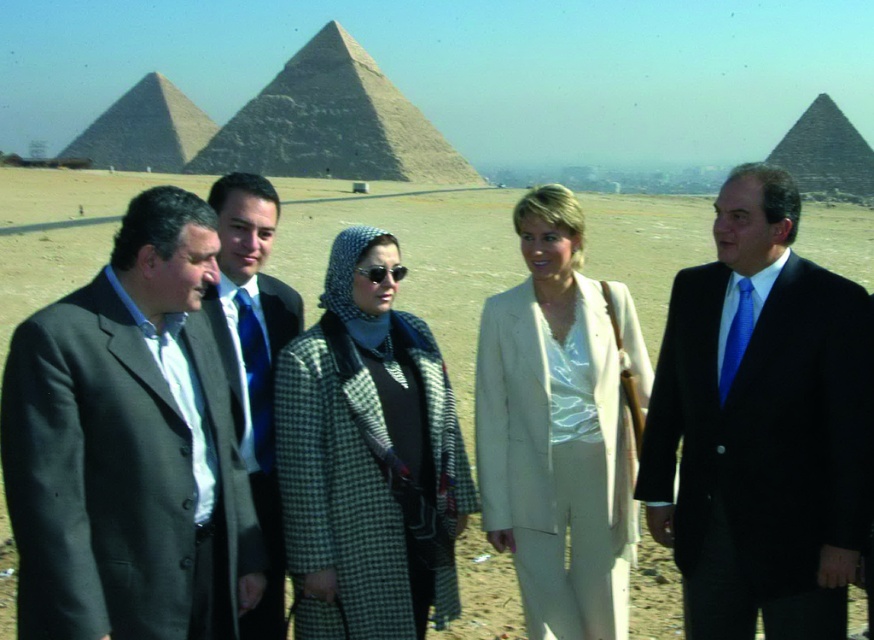
You are a photographer positioned to the left of the group. You want to capture a photo where the blue silk tie at center and the smooth stone pyramid at upper left are both visible. Which object should you position closer to the left side of the frame to ensure both are included?

You should position the smooth stone pyramid at upper left closer to the left side of the frame because the blue silk tie at center is to the right of it. By placing the pyramid on the left, you can ensure the tie, being to the right of the pyramid, stays within the frame.

You are a photographer trying to capture a clear shot of the beige fabric suit at center without the desert at center blocking it. Is this possible given their positions?

The desert at center is positioned over the beige fabric suit at center, so it would block the view of the suit. Adjust your angle or move closer to avoid the desert obstruction.

Looking at this image, you are a photographer trying to capture a photo of the blue silk tie at center and the smooth stone pyramid at upper left in the background. Which object is closer to the camera?

The blue silk tie at center is closer to the camera because it is smaller than the smooth stone pyramid at upper left, which is further away.